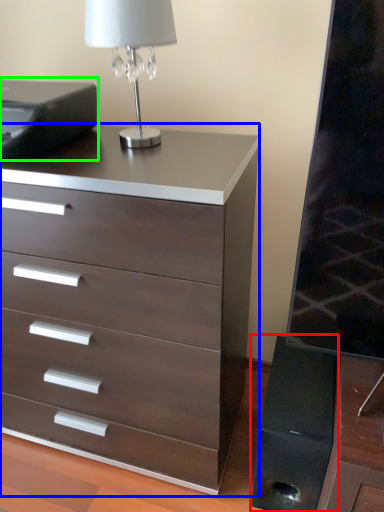
Question: Based on their relative distances, which object is nearer to speaker (highlighted by a red box)? Choose from chest of drawers (highlighted by a blue box) and printer (highlighted by a green box).

Choices:
 (A) chest of drawers
 (B) printer

Answer: (A)